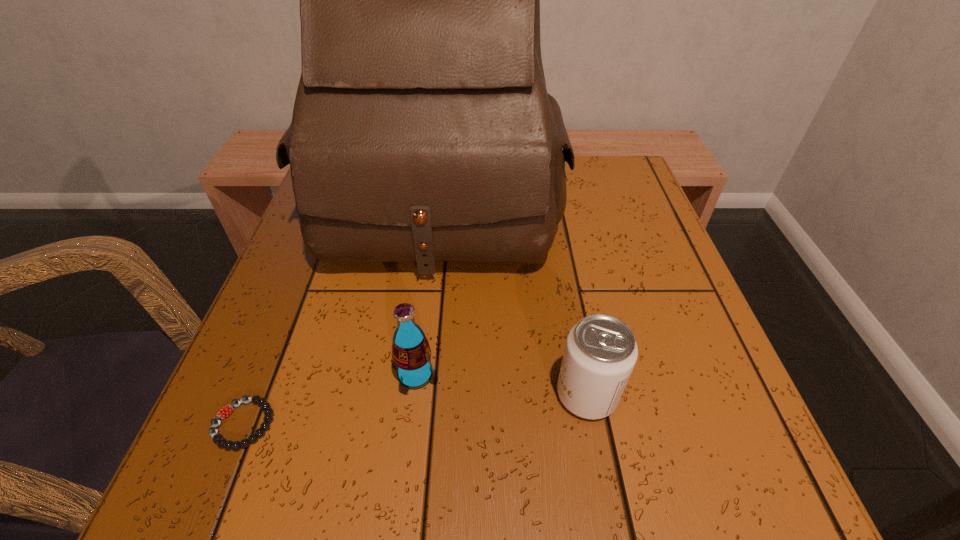
The image size is (960, 540). Find the location of `object that is at the near edge`. object that is at the near edge is located at coordinates (x=224, y=412).

Locate an element on the screen. satchel at the left edge is located at coordinates (422, 130).

Locate an element on the screen. The width and height of the screenshot is (960, 540). bracelet situated at the left edge is located at coordinates (224, 412).

Locate an element on the screen. object that is at the far left corner is located at coordinates (422, 130).

The image size is (960, 540). Find the location of `object present at the near left corner`. object present at the near left corner is located at coordinates (224, 412).

In the image, there is a desktop. In order to click on vacant space at the near edge in this screenshot , I will do `click(524, 494)`.

What are the coordinates of `free space at the left edge of the desktop` in the screenshot? It's located at (245, 387).

Where is `vacant space at the right edge`? This screenshot has width=960, height=540. vacant space at the right edge is located at coordinates (610, 222).

This screenshot has height=540, width=960. Identify the location of vacant space that is in between the shortest object and the left soda can. (329, 399).

Identify the location of vacant area between the right soda can and the bracelet. This screenshot has height=540, width=960. (415, 409).